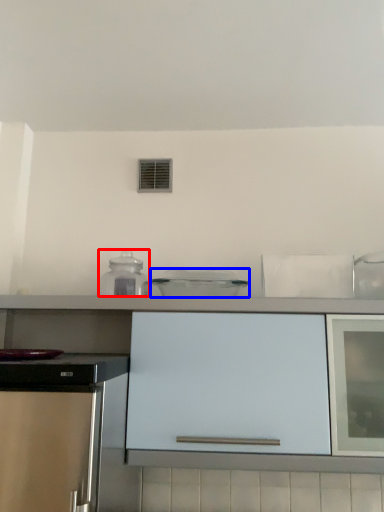
Question: Which object appears closest to the camera in this image, kitchen appliance (highlighted by a red box) or kitchen appliance (highlighted by a blue box)?

Choices:
 (A) kitchen appliance
 (B) kitchen appliance

Answer: (B)